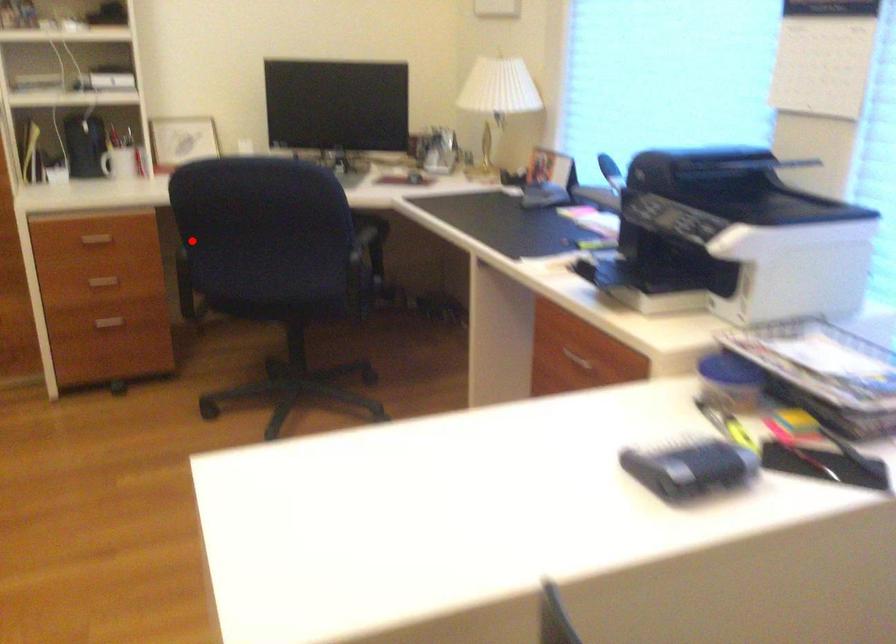
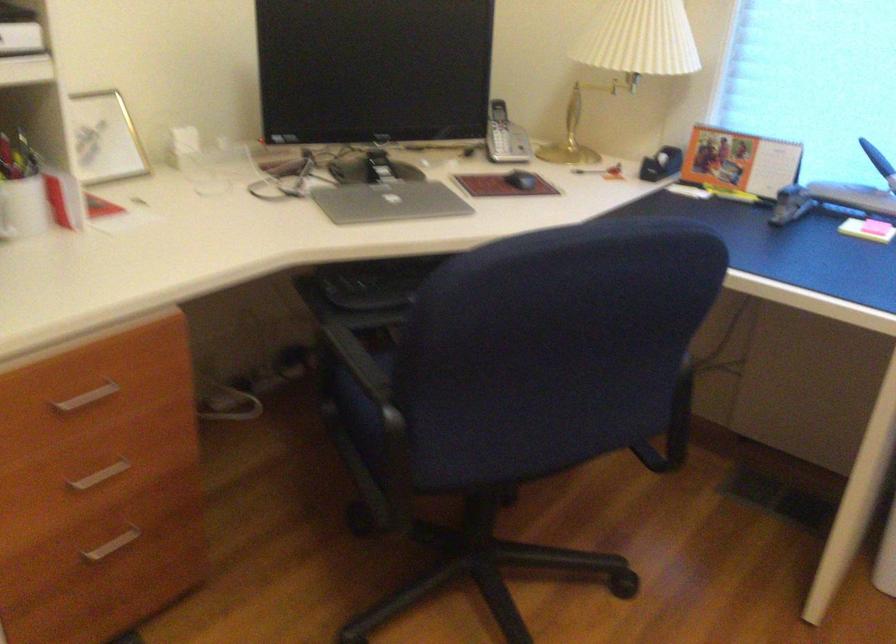
In the second image, find the point that corresponds to the highlighted location in the first image.

(365, 375)